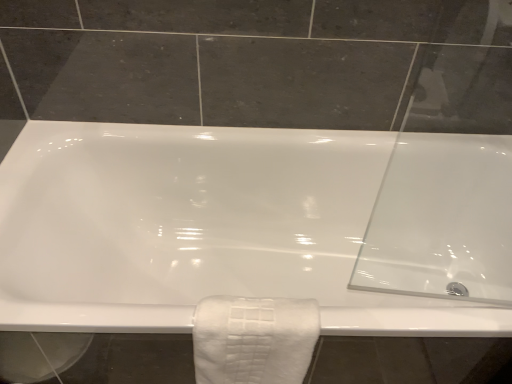
Question: Considering the positions of white textured towel at lower center and white glossy bathtub at center in the image, is white textured towel at lower center bigger or smaller than white glossy bathtub at center?

Choices:
 (A) big
 (B) small

Answer: (B)

Question: In the image, is white textured towel at lower center positioned in front of or behind white glossy bathtub at center?

Choices:
 (A) front
 (B) behind

Answer: (A)

Question: Is point (254, 317) closer or farther from the camera than point (35, 173)?

Choices:
 (A) closer
 (B) farther

Answer: (A)

Question: In terms of height, does white glossy bathtub at center look taller or shorter compared to white textured towel at lower center?

Choices:
 (A) short
 (B) tall

Answer: (B)

Question: From a real-world perspective, is white glossy bathtub at center above or below white textured towel at lower center?

Choices:
 (A) above
 (B) below

Answer: (B)

Question: Is point (279, 185) positioned closer to the camera than point (244, 380)?

Choices:
 (A) closer
 (B) farther

Answer: (B)

Question: Visually, is white glossy bathtub at center positioned to the left or to the right of white textured towel at lower center?

Choices:
 (A) right
 (B) left

Answer: (A)